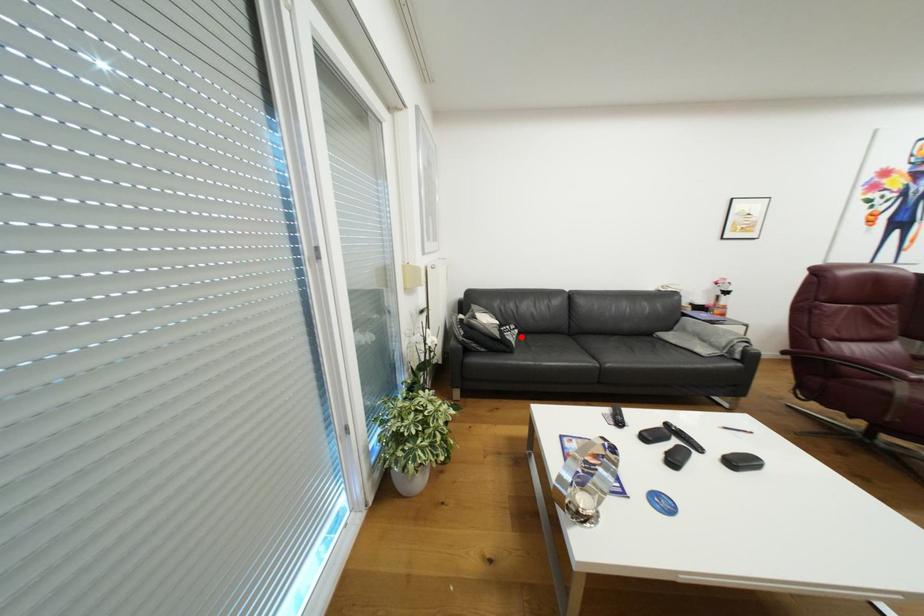
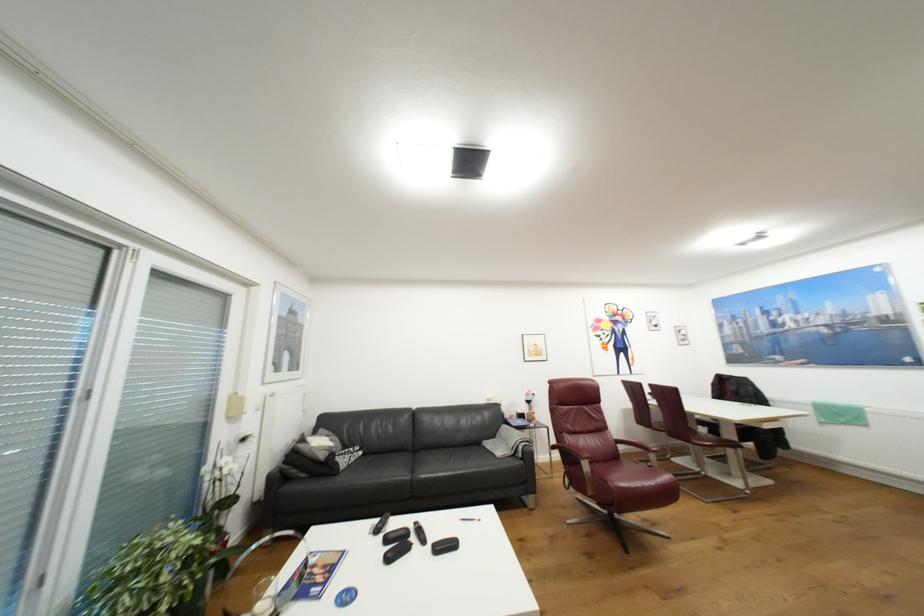
The point at the highlighted location is marked in the first image. Where is the corresponding point in the second image?

(359, 459)